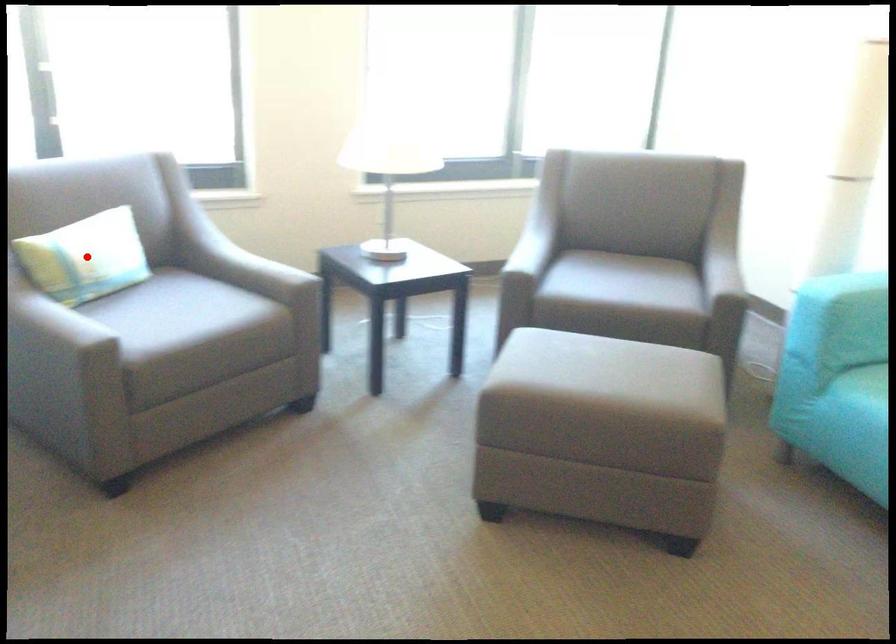
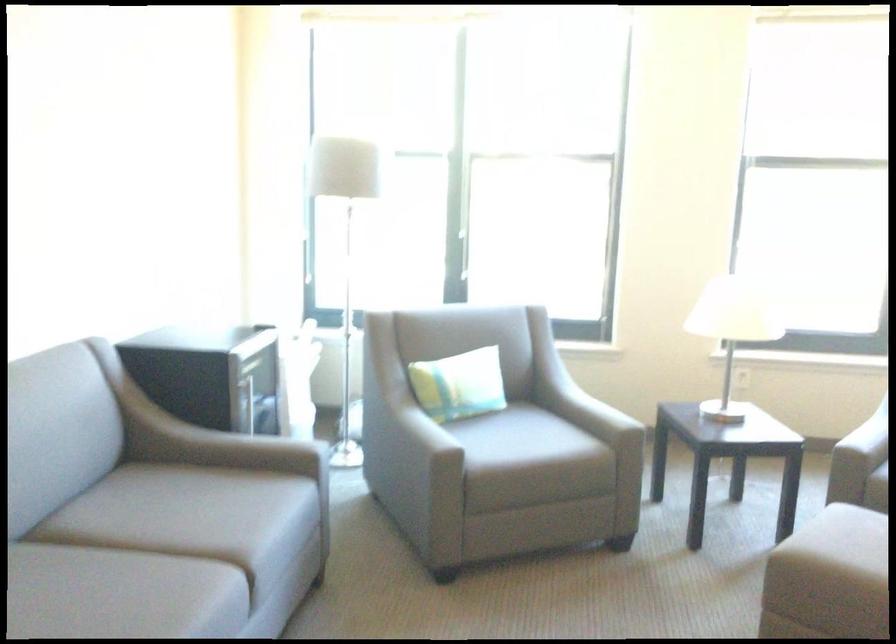
In the second image, find the point that corresponds to the highlighted location in the first image.

(459, 384)